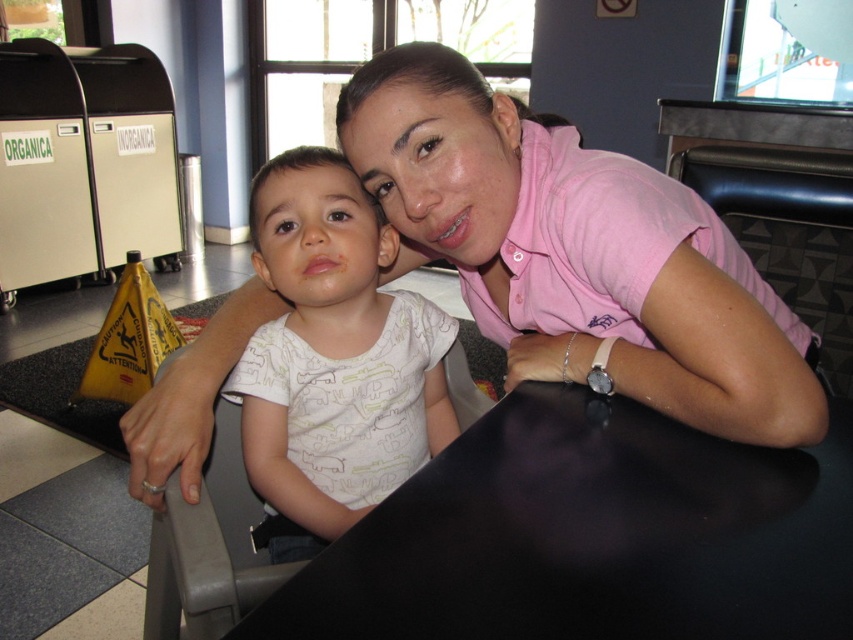
Between pink cotton shirt at center and white printed shirt at center, which one has more height?

white printed shirt at center is taller.

Is point (608, 182) positioned behind point (399, 465)?

No.

Identify the location of pink cotton shirt at center. (576, 252).